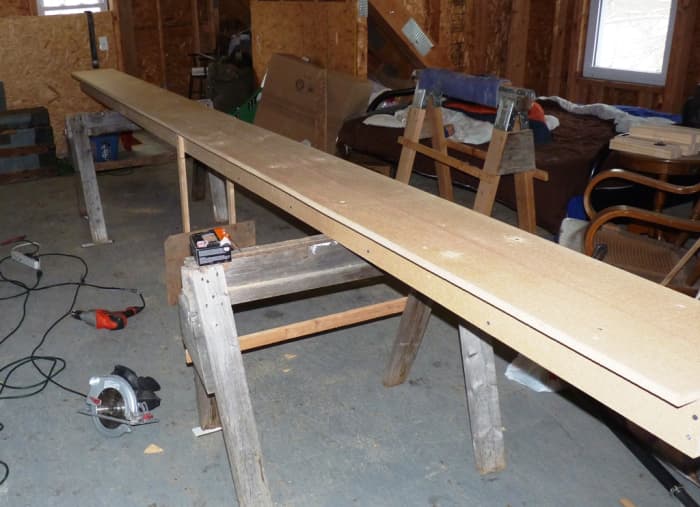
Where is `wood beam`? The width and height of the screenshot is (700, 507). wood beam is located at coordinates (542, 337).